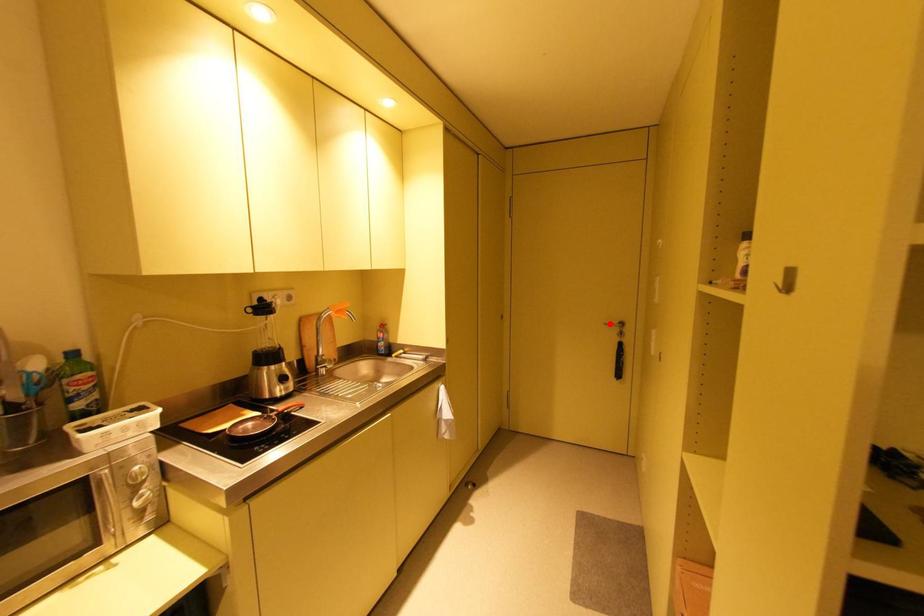
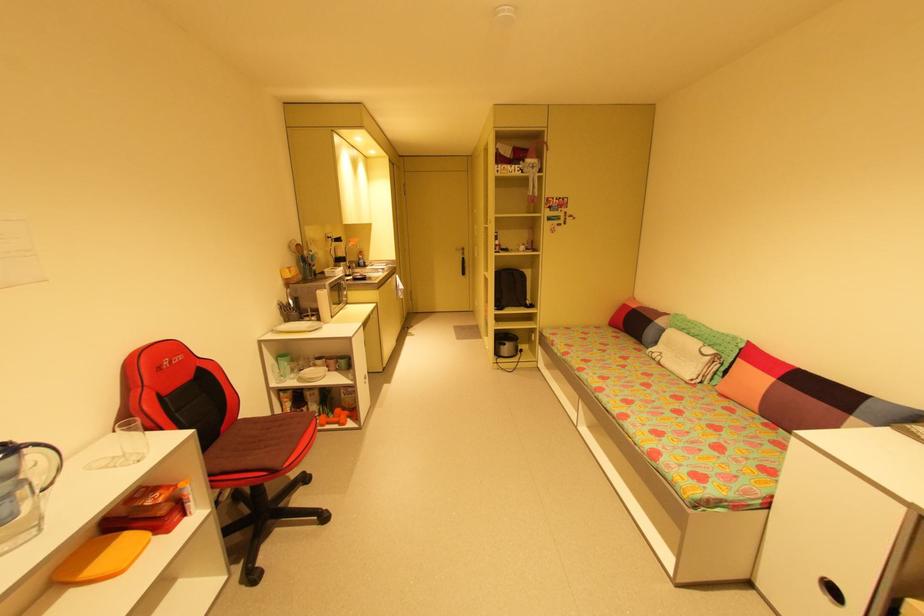
In the second image, find the point that corresponds to the highlighted location in the first image.

(460, 249)